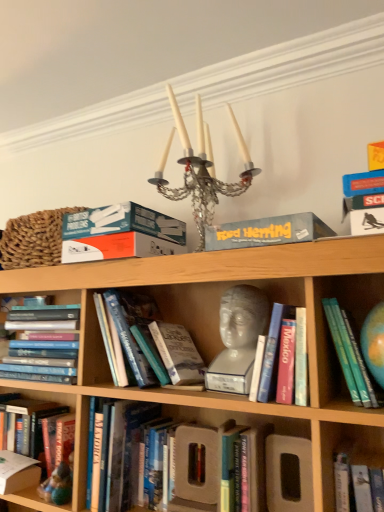
Question: Can you confirm if hardcover book at lower left, which is the fifth book from right to left, is positioned to the right of braided straw basket at upper left?

Choices:
 (A) no
 (B) yes

Answer: (A)

Question: Is hardcover book at lower left, which is the first book in left-to-right order, shorter than braided straw basket at upper left?

Choices:
 (A) no
 (B) yes

Answer: (B)

Question: Are hardcover book at lower left, which is the fifth book from right to left, and braided straw basket at upper left located far from each other?

Choices:
 (A) no
 (B) yes

Answer: (A)

Question: Does hardcover book at lower left, which is the first book in left-to-right order, have a greater width compared to braided straw basket at upper left?

Choices:
 (A) no
 (B) yes

Answer: (A)

Question: Is braided straw basket at upper left completely or partially inside hardcover book at lower left, which is the fifth book from right to left?

Choices:
 (A) yes
 (B) no

Answer: (B)

Question: From a real-world perspective, is hardcover books at center left, which ranks as the fourth book in right-to-left order, above or below matte pink book at center, which appears as the second book when viewed from the right?

Choices:
 (A) above
 (B) below

Answer: (A)

Question: In terms of height, does hardcover books at center left, which is the 2th book in left-to-right order, look taller or shorter compared to matte pink book at center, which appears as the second book when viewed from the right?

Choices:
 (A) short
 (B) tall

Answer: (B)

Question: Visually, is hardcover books at center left, which ranks as the fourth book in right-to-left order, positioned to the left or to the right of matte pink book at center, which appears as the second book when viewed from the right?

Choices:
 (A) right
 (B) left

Answer: (B)

Question: From the image's perspective, relative to matte pink book at center, which appears as the fourth book when viewed from the left, is hardcover books at center left, which is the 2th book in left-to-right order, above or below?

Choices:
 (A) below
 (B) above

Answer: (A)

Question: From their relative heights in the image, would you say hardcover book at lower left, positioned as the 1th paperback book in bottom-to-top order, is taller or shorter than blue cardboard box at upper center, the 2th paperback book positioned from the bottom?

Choices:
 (A) tall
 (B) short

Answer: (A)

Question: Looking at the image, does hardcover book at lower left, positioned as the third paperback book in top-to-bottom order, seem bigger or smaller compared to blue cardboard box at upper center, which is the 2th paperback book from top to bottom?

Choices:
 (A) small
 (B) big

Answer: (A)

Question: Is hardcover book at lower left, positioned as the third paperback book in top-to-bottom order, inside the boundaries of blue cardboard box at upper center, the 2th paperback book positioned from the bottom, or outside?

Choices:
 (A) outside
 (B) inside

Answer: (A)

Question: Is hardcover book at lower left, positioned as the 3th paperback book in right-to-left order, wider or thinner than blue cardboard box at upper center, placed as the 3th paperback book when sorted from left to right?

Choices:
 (A) wide
 (B) thin

Answer: (B)

Question: Considering the positions of braided straw basket at upper left and teal matte board game box at upper center, the third paperback book ordered from the bottom, in the image, is braided straw basket at upper left bigger or smaller than teal matte board game box at upper center, the third paperback book ordered from the bottom,?

Choices:
 (A) big
 (B) small

Answer: (A)

Question: In terms of width, does braided straw basket at upper left look wider or thinner when compared to teal matte board game box at upper center, the third paperback book ordered from the bottom?

Choices:
 (A) thin
 (B) wide

Answer: (A)